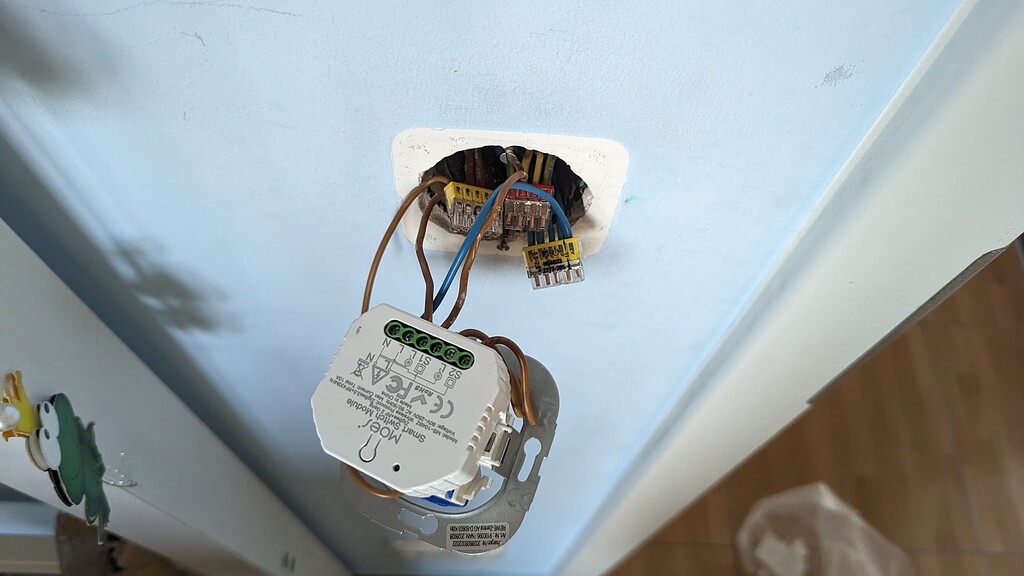
Locate an element on the screen. This screenshot has height=576, width=1024. trim is located at coordinates point(835,390).